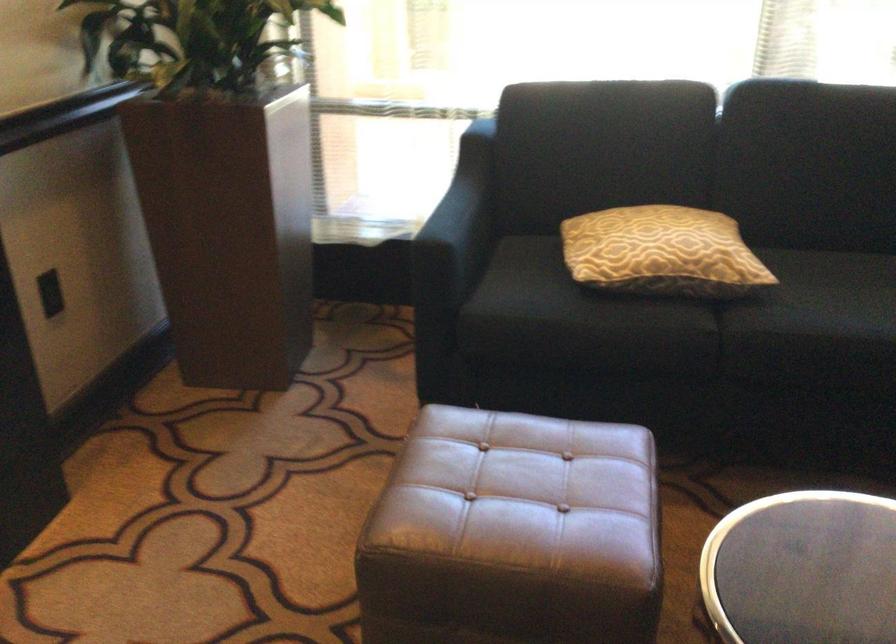
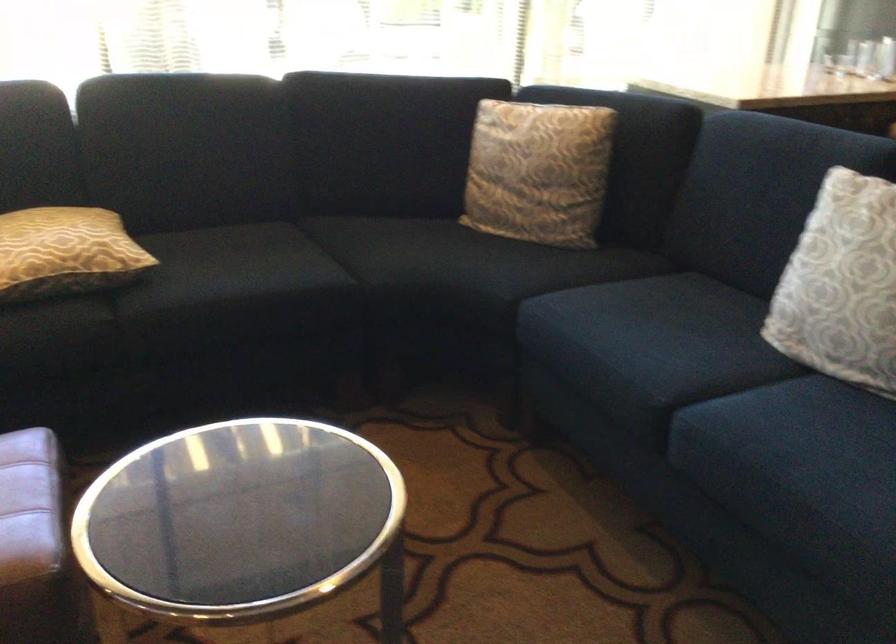
The point at [681,254] is marked in the first image. Where is the corresponding point in the second image?

(65, 252)